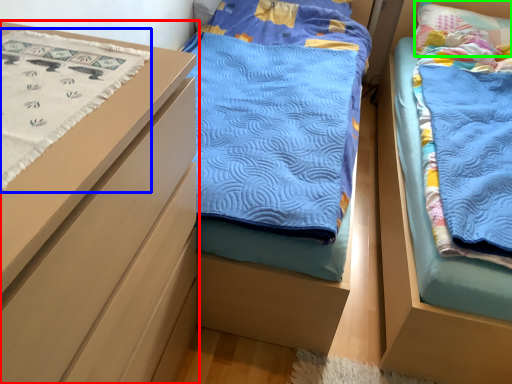
Question: Which object is the closest to the chest of drawers (highlighted by a red box)? Choose among these: blanket (highlighted by a blue box) or pillow (highlighted by a green box).

Choices:
 (A) blanket
 (B) pillow

Answer: (A)